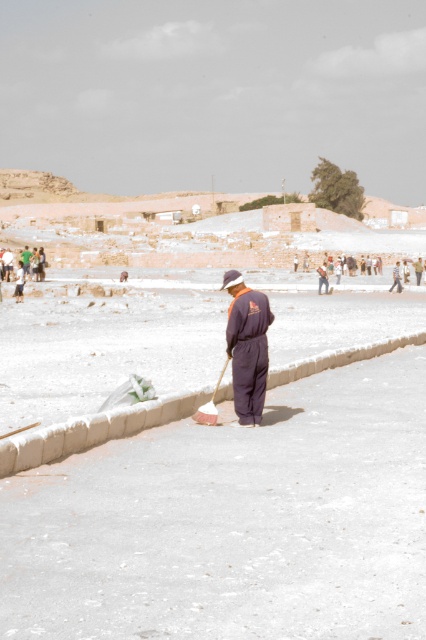
You are standing at the point with coordinates 0.7, 0.5 in the image. You want to walk to the white concrete pavement at center. In which direction should you move?

The white concrete pavement at center is located at point (233, 522). Since your current position is at (213, 448), you should move northeast to reach it.

You are a tourist at this historical site and need to decide where to place your backpack. You have two options at the center of the scene. Which object would be more suitable for placing your backpack, the white concrete pavement at center or the white plastic shovel at center?

The white concrete pavement at center is larger in size than the white plastic shovel at center, so it would be more suitable for placing your backpack as it provides a stable and spacious surface.